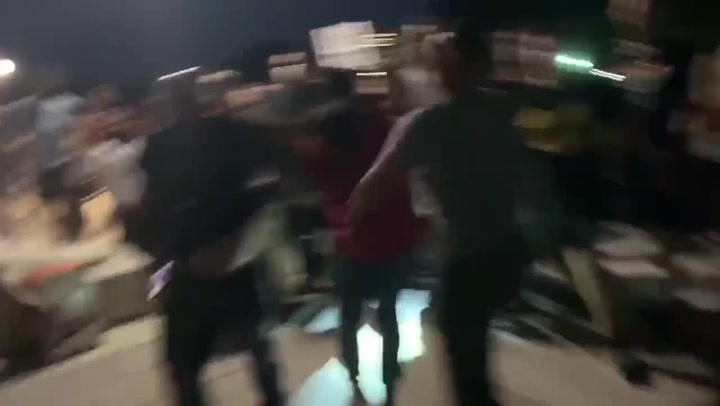
At what (x,y) coordinates should I click in order to perform the action: click on light on floor. Please return your answer as a coordinate pair (x, y). The image size is (720, 406). Looking at the image, I should click on (414, 303), (328, 387), (323, 320).